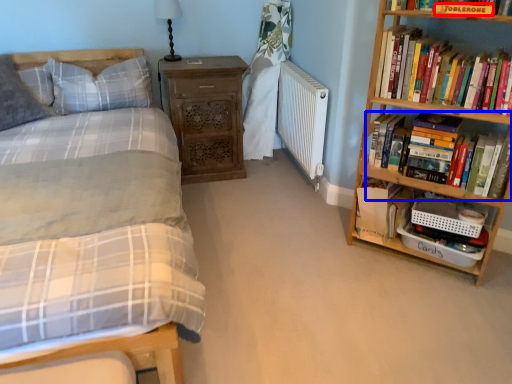
Question: Which object appears farthest to the camera in this image, paperback book (highlighted by a red box) or book (highlighted by a blue box)?

Choices:
 (A) paperback book
 (B) book

Answer: (B)